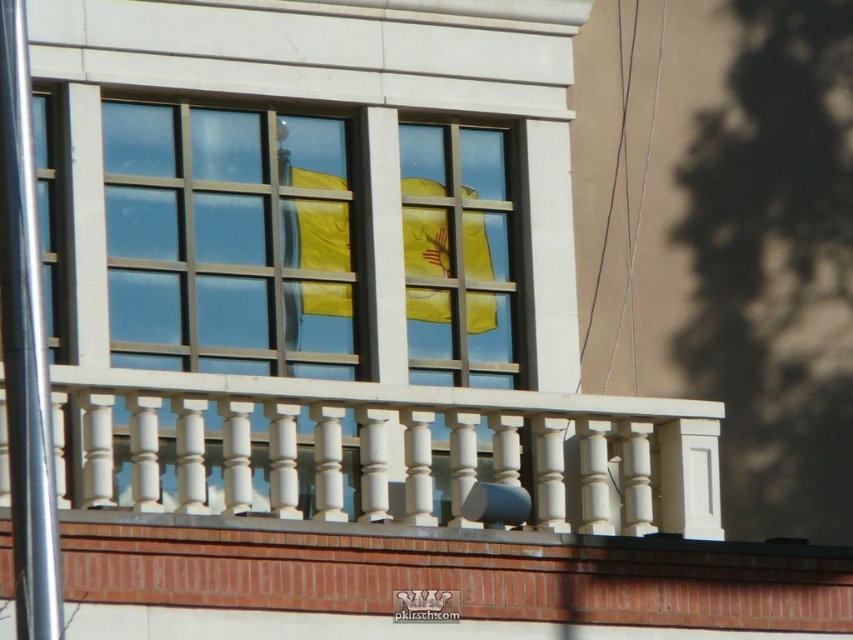
You are standing in front of the building and notice the white painted wood balcony at center. Can you determine its exact position using the coordinate system provided?

The white painted wood balcony at center is located at point coordinates [380,451].

You are standing in front of the classical building and see two points marked on the structure. The first point is at coordinates point (61, 376) and the second is at point (430, 269). Which point is closer to your viewpoint?

Point (61, 376) is in front of point (430, 269), so it is closer to your viewpoint.

You are standing in front of the building described in the scene. There is a point at coordinates (380, 451). What object is located at that point?

The white painted wood balcony at center is located at point (380, 451).